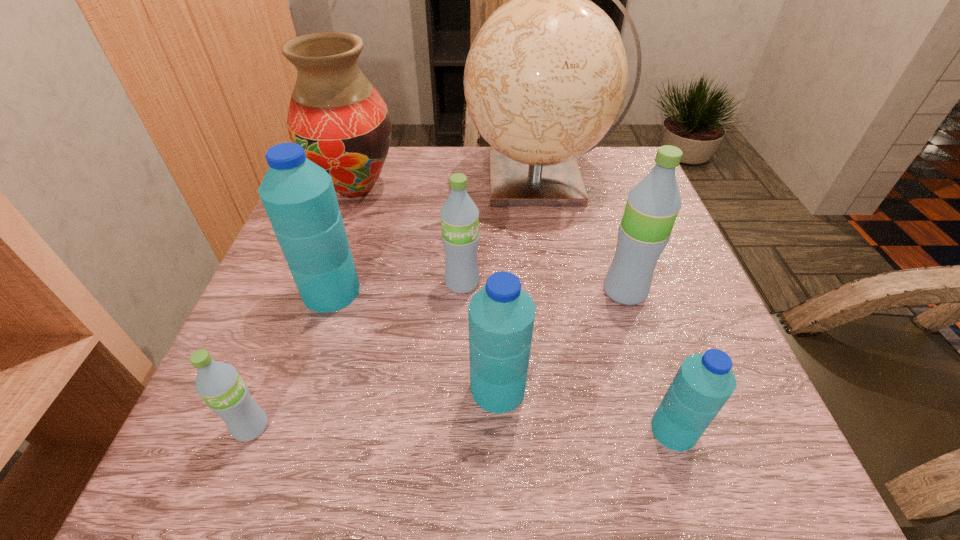
I want to click on beige globe, so click(x=546, y=76).

Find the location of a particular element. The image size is (960, 540). the tallest object is located at coordinates (546, 76).

Where is `vase`? The width and height of the screenshot is (960, 540). vase is located at coordinates (341, 121).

You are a GUI agent. You are given a task and a screenshot of the screen. Output one action in this format:
    pyautogui.click(x=<x>, y=<y>)
    Task: Click on the biggest green water bottle
    The height and width of the screenshot is (540, 960).
    Given the screenshot: What is the action you would take?
    pyautogui.click(x=652, y=206)

Locate an element on the screen. the leftmost blue water bottle is located at coordinates (299, 198).

This screenshot has height=540, width=960. In order to click on the biggest blue water bottle in this screenshot , I will do `click(299, 198)`.

This screenshot has height=540, width=960. I want to click on the second biggest green water bottle, so click(x=459, y=215).

In order to click on the second blue water bottle from right to left in this screenshot , I will do `click(501, 315)`.

The height and width of the screenshot is (540, 960). What are the coordinates of `the rightmost blue water bottle` in the screenshot? It's located at (704, 382).

The width and height of the screenshot is (960, 540). Identify the location of the nearest green water bottle. (219, 384).